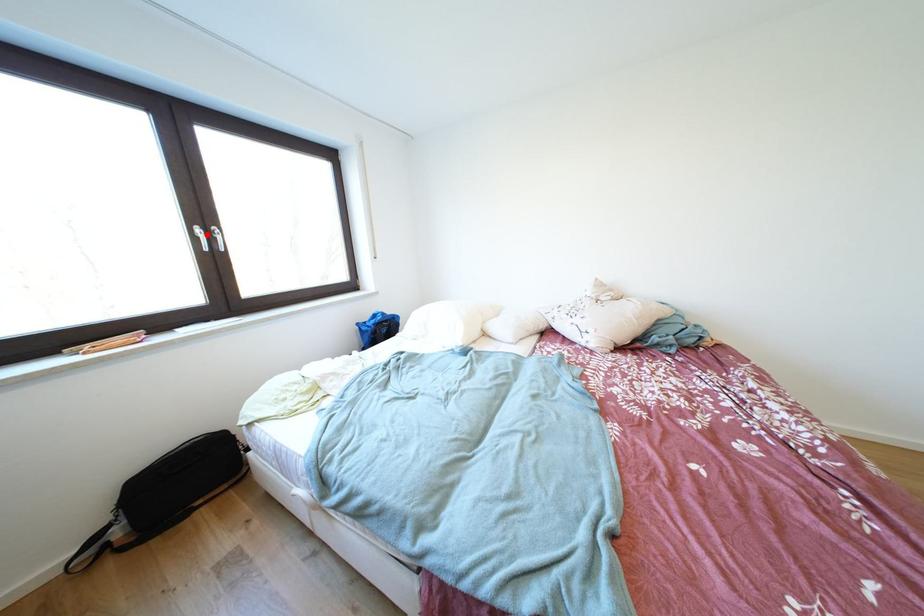
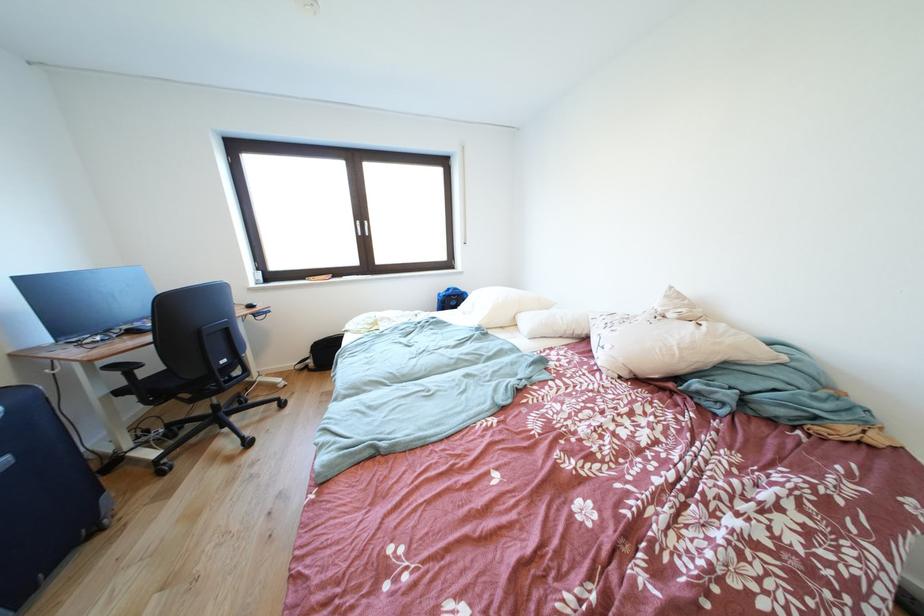
Question: A red point is marked in image1. In image2, is the corresponding 3D point closer to the camera or farther? Reply with the corresponding letter.

Choices:
 (A) The corresponding 3D point is closer.
 (B) The corresponding 3D point is farther.

Answer: (A)